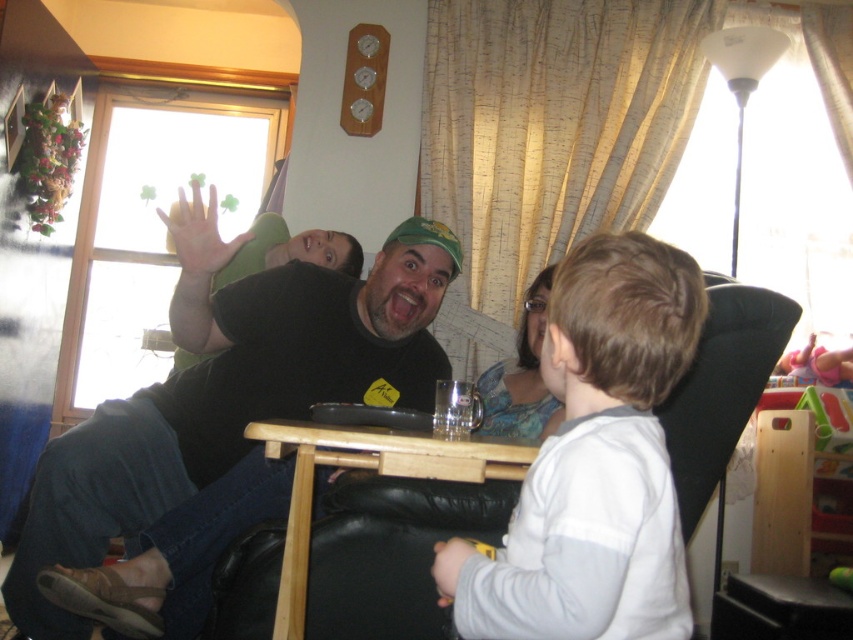
You are a photographer trying to capture a candid shot of the man in the scene. You notice the white fleece shirt at center and the white matte hand at upper center. Which object should you focus on to ensure the man is in the frame?

The white fleece shirt at center is to the right of white matte hand at upper center. To ensure the man is in the frame, focus on the white fleece shirt at center since it is closer to the man.

You are a photographer trying to capture a candid shot of the man in the scene. You notice the white fleece shirt at center and the smooth skin hand at lower center. Which object would appear bigger in your photo?

The white fleece shirt at center would appear bigger in the photo since it is larger in size than the smooth skin hand at lower center according to the description.